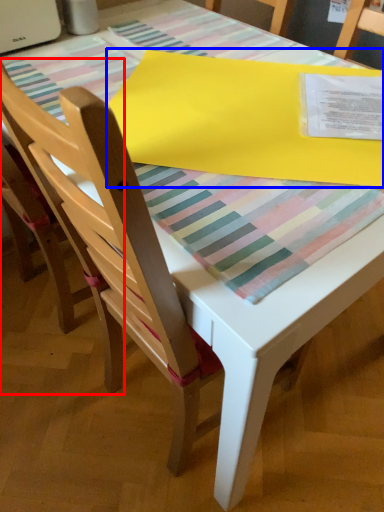
Question: Which point is further to the camera, chair (highlighted by a red box) or blanket (highlighted by a blue box)?

Choices:
 (A) chair
 (B) blanket

Answer: (B)